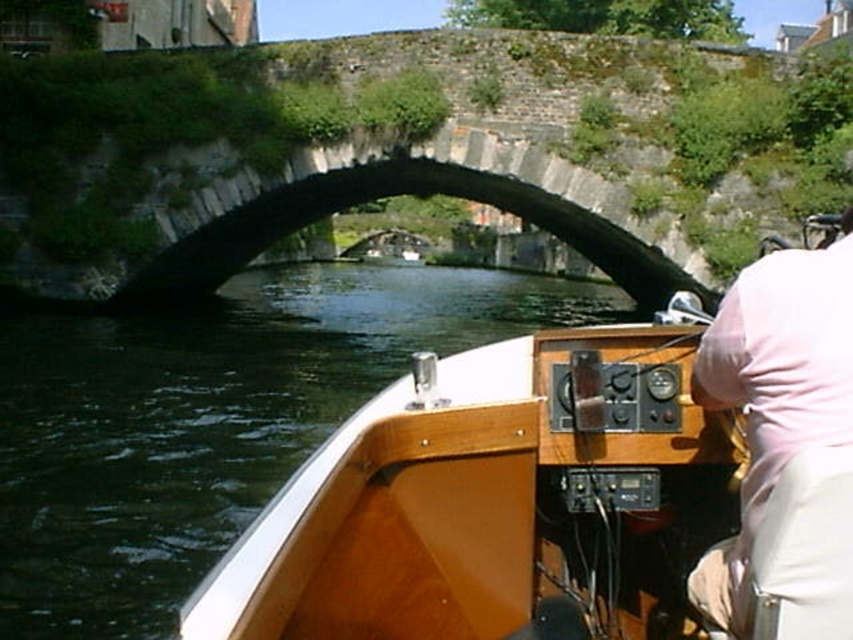
Question: Which of the following is the closest to the observer?

Choices:
 (A) wooden boat at center
 (B) dark gray stone bridge at center
 (C) pink fabric shirt at right

Answer: (C)

Question: Is wooden boat at center in front of dark gray stone bridge at center?

Choices:
 (A) no
 (B) yes

Answer: (B)

Question: Is dark gray stone bridge at center smaller than pink fabric shirt at right?

Choices:
 (A) no
 (B) yes

Answer: (A)

Question: Based on their relative distances, which object is nearer to the dark gray stone bridge at center?

Choices:
 (A) wooden boat at center
 (B) pink fabric shirt at right

Answer: (B)

Question: Which object appears closest to the camera in this image?

Choices:
 (A) dark gray stone bridge at center
 (B) pink fabric shirt at right

Answer: (B)

Question: Does wooden boat at center come behind pink fabric shirt at right?

Choices:
 (A) no
 (B) yes

Answer: (B)